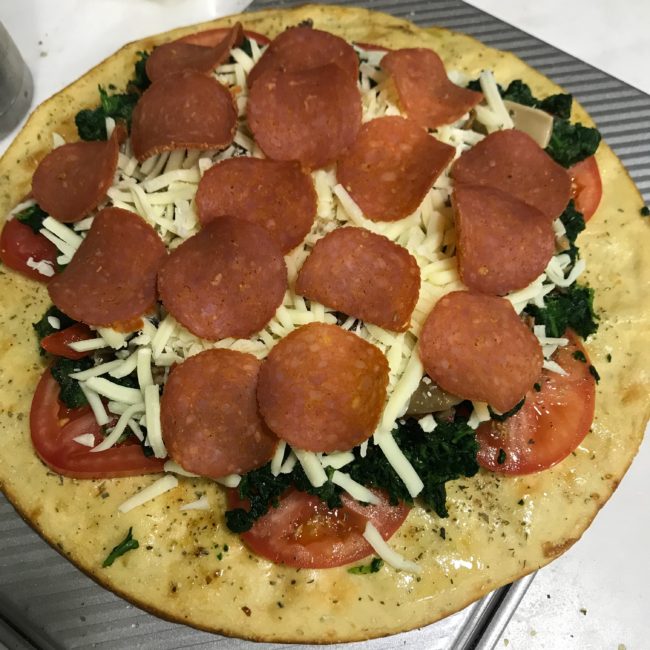
Identify the location of corner. The height and width of the screenshot is (650, 650). (632, 632), (17, 619), (17, 17), (634, 15).